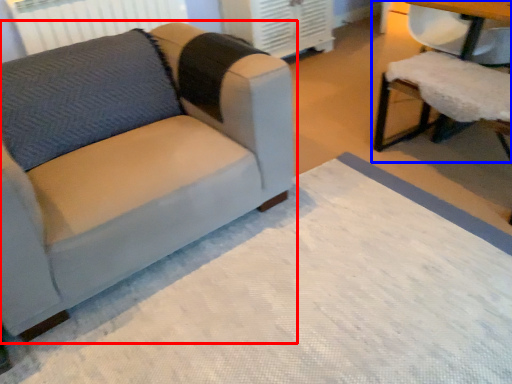
Question: Which object appears closest to the camera in this image, studio couch (highlighted by a red box) or chair (highlighted by a blue box)?

Choices:
 (A) studio couch
 (B) chair

Answer: (A)